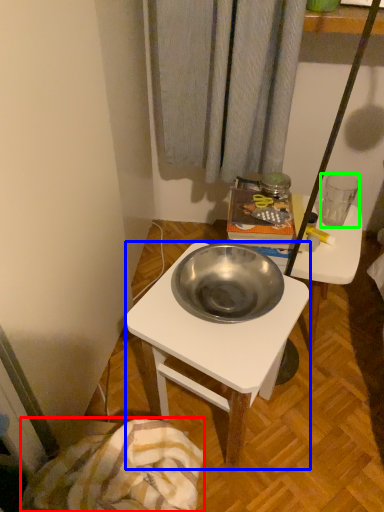
Question: Based on their relative distances, which object is farther from blanket (highlighted by a red box)? Choose from desk (highlighted by a blue box) and coffee cup (highlighted by a green box).

Choices:
 (A) desk
 (B) coffee cup

Answer: (B)